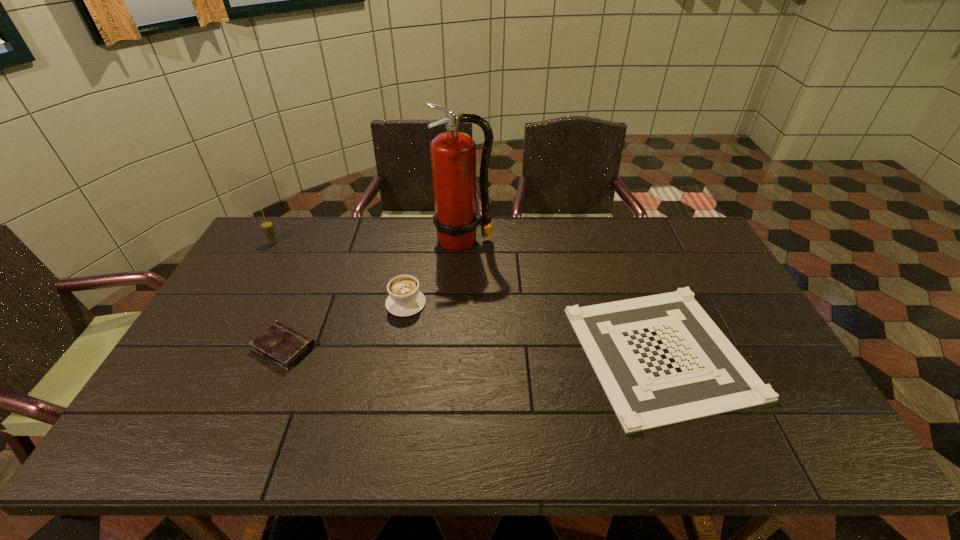
This screenshot has height=540, width=960. I want to click on object at the left edge, so click(x=267, y=226).

Identify the location of object located at the right edge. The height and width of the screenshot is (540, 960). (660, 359).

Where is `object at the far left corner`? The image size is (960, 540). object at the far left corner is located at coordinates (267, 226).

You are a GUI agent. You are given a task and a screenshot of the screen. Output one action in this format:
    pyautogui.click(x=<x>, y=<y>)
    Task: Click on the object that is at the near right corner
    
    Given the screenshot: What is the action you would take?
    pyautogui.click(x=660, y=359)

In the image, there is a desktop. Identify the location of vacant area at the far edge. The height and width of the screenshot is (540, 960). (641, 233).

In the image, there is a desktop. Identify the location of vacant region at the left edge. This screenshot has height=540, width=960. (228, 376).

Locate an element on the screen. The image size is (960, 540). vacant space at the right edge is located at coordinates click(x=777, y=376).

Find the location of a particular element. blank space at the far left corner is located at coordinates (292, 233).

At what (x,y) coordinates should I click in order to perform the action: click on vacant space at the near left corner. Please return your answer as a coordinate pair (x, y). Image resolution: width=960 pixels, height=540 pixels. Looking at the image, I should click on (170, 437).

Where is `vacant area at the far right corner`? vacant area at the far right corner is located at coordinates (682, 227).